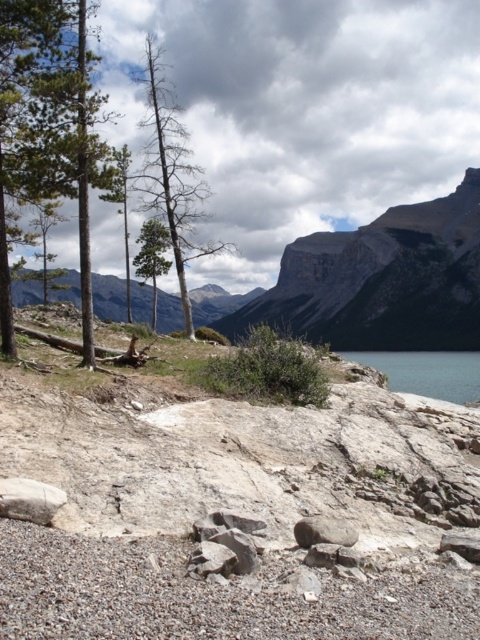
Is green pine tree at left to the right of blue smooth water at lower right from the viewer's perspective?

No, green pine tree at left is not to the right of blue smooth water at lower right.

Does green pine tree at left appear over blue smooth water at lower right?

Yes.

Does point (72, 67) lie in front of point (408, 364)?

Yes, it is.

Find the location of `green pine tree at left`. green pine tree at left is located at coordinates (38, 115).

Does green pine tree at left appear under gray rock at center?

Actually, green pine tree at left is above gray rock at center.

Who is taller, green pine tree at left or gray rock at center?

Standing taller between the two is green pine tree at left.

Who is more distant from viewer, [70,138] or [333,525]?

The point [70,138] is more distant.

The width and height of the screenshot is (480, 640). What are the coordinates of `green pine tree at left` in the screenshot? It's located at (38, 115).

Can you confirm if rugged stone mountain at upper center is wider than green pine tree at left?

Correct, the width of rugged stone mountain at upper center exceeds that of green pine tree at left.

Between rugged stone mountain at upper center and green pine tree at left, which one appears on the left side from the viewer's perspective?

green pine tree at left

Is point (374, 260) farther from camera compared to point (6, 353)?

That is True.

Where is `rugged stone mountain at upper center`? rugged stone mountain at upper center is located at coordinates (382, 280).